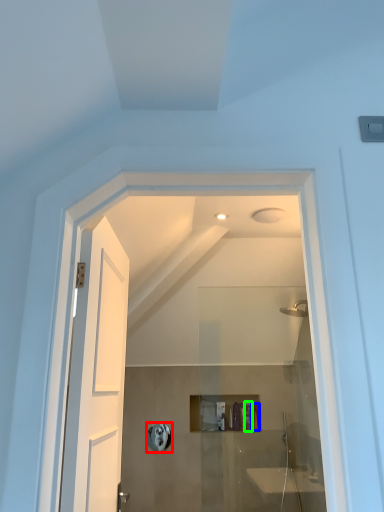
Question: Which object is the farthest from towel bar (highlighted by a red box)? Choose among these: toiletry (highlighted by a blue box) or toiletry (highlighted by a green box).

Choices:
 (A) toiletry
 (B) toiletry

Answer: (A)